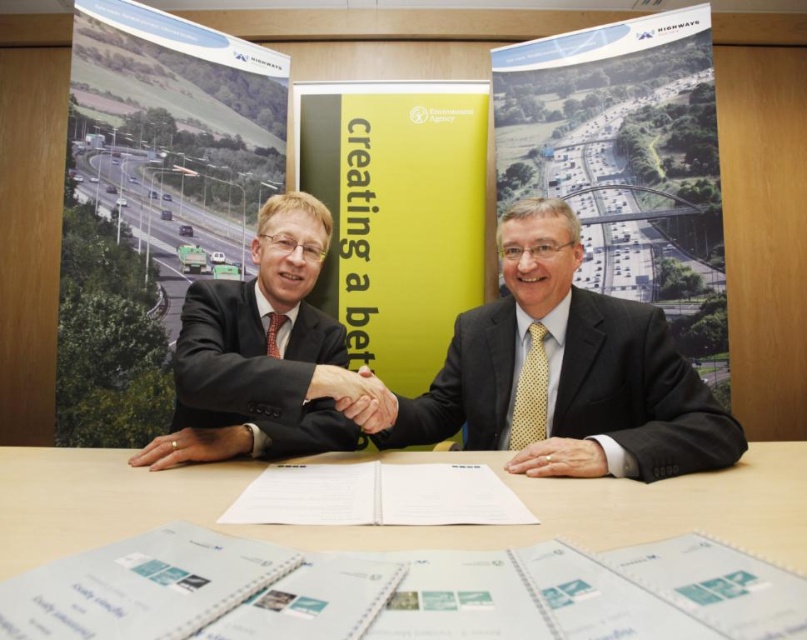
You are an event photographer capturing a formal meeting between two individuals. You need to ensure that both the dark gray suit at center and the golden textured hand at center are clearly visible in your photo. Considering their sizes, which object should you focus on to ensure proper exposure and sharpness?

The dark gray suit at center has a larger size compared to the golden textured hand at center, so you should focus on the dark gray suit at center to ensure proper exposure and sharpness since it occupies more space in the frame.

You are a document reviewer who needs to locate the white paper at center. According to the coordinates provided, where exactly would you find it in the image?

The white paper at center is located at point coordinates of (x=381, y=563).

You are a photographer taking a portrait of the dark gray suit at center and the golden textured hand at center. Which object will appear larger in your photo?

The dark gray suit at center will appear larger in the photo because it is closer to the viewer than the golden textured hand at center.